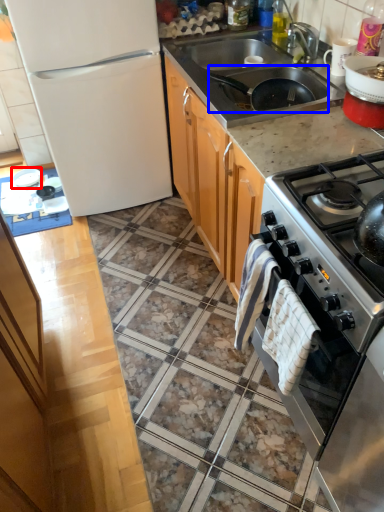
Question: Which point is further to the camera, appliance (highlighted by a red box) or frying pan (highlighted by a blue box)?

Choices:
 (A) appliance
 (B) frying pan

Answer: (A)